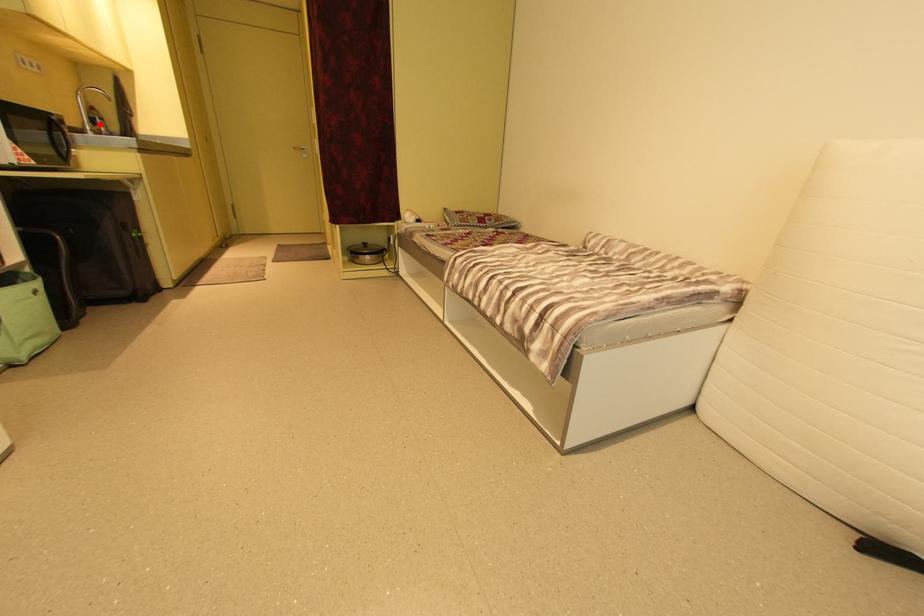
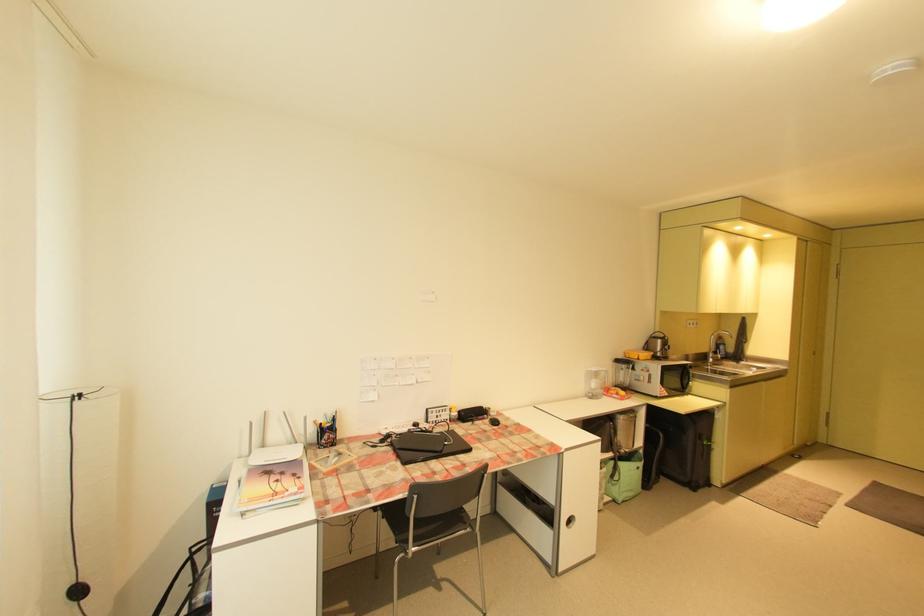
The point at the highlighted location is marked in the first image. Where is the corresponding point in the second image?

(722, 353)